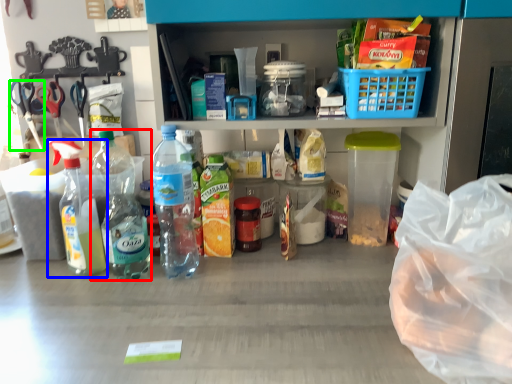
Question: Which is farther away from bottle (highlighted by a red box)? bottle (highlighted by a blue box) or scissors (highlighted by a green box)?

Choices:
 (A) bottle
 (B) scissors

Answer: (B)